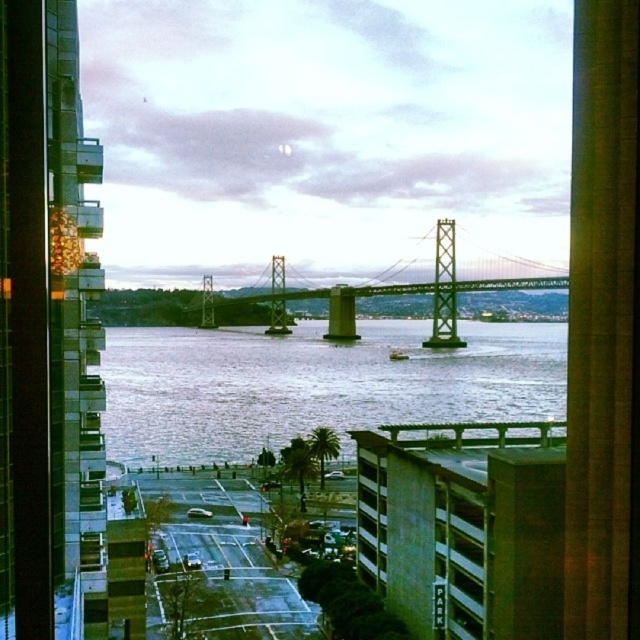
Which of these two, green matte parking garage at lower right or green glass window at center, stands taller?

With more height is green glass window at center.

Find the location of a particular element. This screenshot has width=640, height=640. green matte parking garage at lower right is located at coordinates (460, 561).

In order to click on green matte parking garage at lower right in this screenshot , I will do `click(460, 561)`.

Between metallic gray suspension bridge at center and green matte parking garage at lower right, which one appears on the left side from the viewer's perspective?

metallic gray suspension bridge at center is more to the left.

Which is below, metallic gray suspension bridge at center or green matte parking garage at lower right?

green matte parking garage at lower right

The height and width of the screenshot is (640, 640). Describe the element at coordinates (378, 296) in the screenshot. I see `metallic gray suspension bridge at center` at that location.

Where is `metallic gray suspension bridge at center`? metallic gray suspension bridge at center is located at coordinates (378, 296).

In the scene shown: Which is below, gray water at center or green glass window at center?

green glass window at center is below.

Can you confirm if gray water at center is positioned to the left of green glass window at center?

In fact, gray water at center is to the right of green glass window at center.

Is point (516, 369) in front of point (368, 481)?

No.

Locate an element on the screen. The width and height of the screenshot is (640, 640). gray water at center is located at coordinates (316, 385).